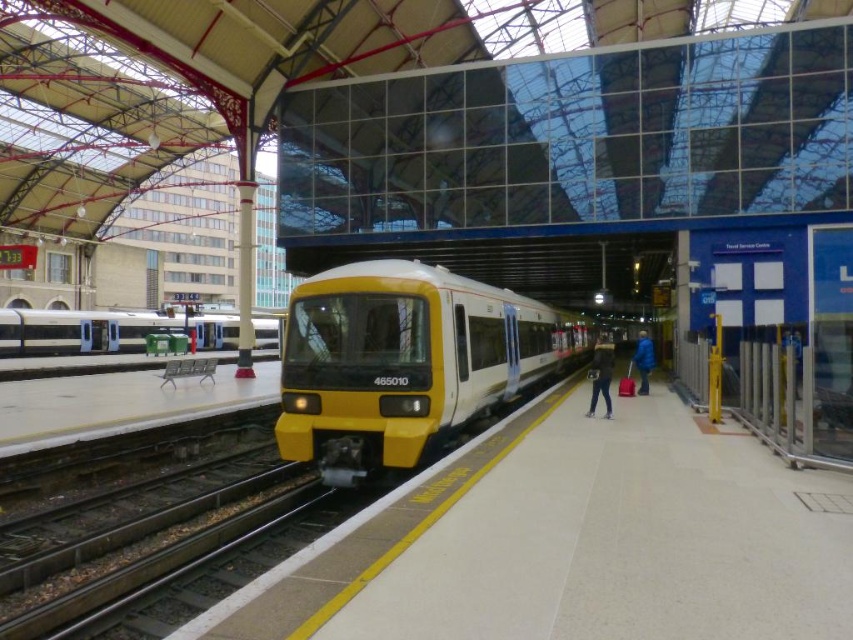
Question: Which of the following is the closest to the observer?

Choices:
 (A) (642, 381)
 (B) (276, 342)
 (C) (350, 388)

Answer: (C)

Question: Does matte silver train at left appear over dark blue jacket at center?

Choices:
 (A) yes
 (B) no

Answer: (A)

Question: Does matte silver train at left have a smaller size compared to blue fabric jacket at right?

Choices:
 (A) no
 (B) yes

Answer: (B)

Question: Which point is closer to the camera taking this photo?

Choices:
 (A) (596, 342)
 (B) (647, 394)
 (C) (137, 349)
 (D) (381, 406)

Answer: (D)

Question: Is matte silver train at left above dark blue jacket at center?

Choices:
 (A) no
 (B) yes

Answer: (B)

Question: Which is farther from the blue fabric jacket at right?

Choices:
 (A) dark blue jacket at center
 (B) yellow matte train at center

Answer: (A)